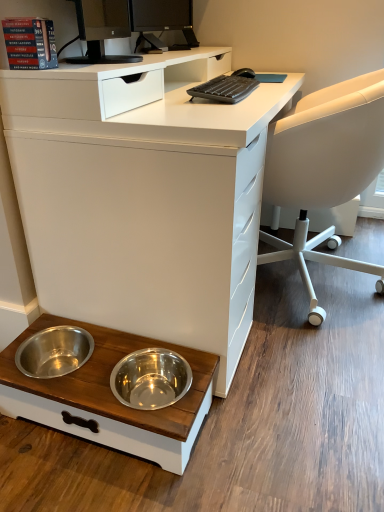
Question: Can you confirm if black glossy monitor at upper center is wider than black plastic keyboard at upper center?

Choices:
 (A) yes
 (B) no

Answer: (B)

Question: Is black glossy monitor at upper center further to the viewer compared to black plastic keyboard at upper center?

Choices:
 (A) yes
 (B) no

Answer: (A)

Question: From the image's perspective, is black glossy monitor at upper center above black plastic keyboard at upper center?

Choices:
 (A) yes
 (B) no

Answer: (A)

Question: Is there a large distance between black glossy monitor at upper center and black plastic keyboard at upper center?

Choices:
 (A) yes
 (B) no

Answer: (B)

Question: Does black glossy monitor at upper center have a greater height compared to black plastic keyboard at upper center?

Choices:
 (A) yes
 (B) no

Answer: (A)

Question: In the image, is white plastic chair at right positioned in front of or behind wooden pet bowls at lower left?

Choices:
 (A) behind
 (B) front

Answer: (A)

Question: Considering the positions of point pos(297,114) and point pos(21,415), is point pos(297,114) closer or farther from the camera than point pos(21,415)?

Choices:
 (A) farther
 (B) closer

Answer: (A)

Question: Would you say white plastic chair at right is inside or outside wooden pet bowls at lower left?

Choices:
 (A) outside
 (B) inside

Answer: (A)

Question: From the image's perspective, is white plastic chair at right located above or below wooden pet bowls at lower left?

Choices:
 (A) below
 (B) above

Answer: (B)

Question: From their relative heights in the image, would you say wooden pet bowls at lower left is taller or shorter than white matte desk at lower left?

Choices:
 (A) short
 (B) tall

Answer: (A)

Question: Considering the positions of wooden pet bowls at lower left and white matte desk at lower left in the image, is wooden pet bowls at lower left wider or thinner than white matte desk at lower left?

Choices:
 (A) thin
 (B) wide

Answer: (A)

Question: From the image's perspective, is wooden pet bowls at lower left located above or below white matte desk at lower left?

Choices:
 (A) above
 (B) below

Answer: (B)

Question: Considering the positions of wooden pet bowls at lower left and white matte desk at lower left in the image, is wooden pet bowls at lower left bigger or smaller than white matte desk at lower left?

Choices:
 (A) small
 (B) big

Answer: (A)

Question: Considering the positions of red paper book at upper left and white matte desk at lower left in the image, is red paper book at upper left wider or thinner than white matte desk at lower left?

Choices:
 (A) wide
 (B) thin

Answer: (B)

Question: From a real-world perspective, is red paper book at upper left positioned above or below white matte desk at lower left?

Choices:
 (A) above
 (B) below

Answer: (A)